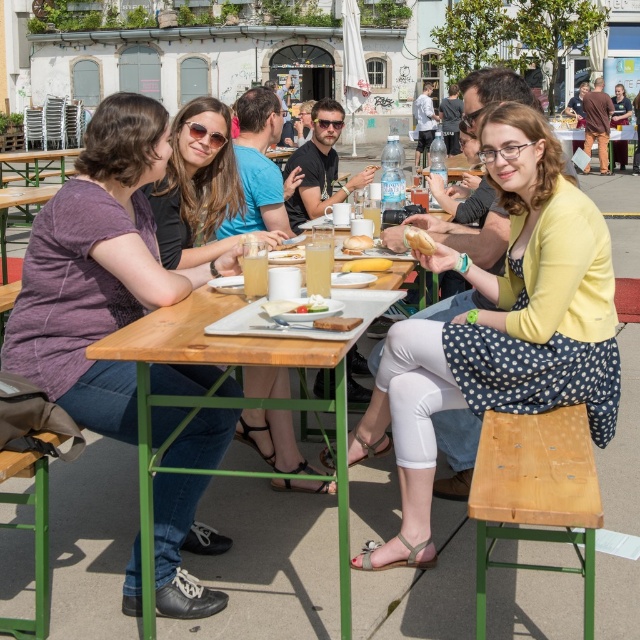
Who is more distant from viewer, (104,344) or (339,317)?

Positioned behind is point (339,317).

Locate an element on the screen. The width and height of the screenshot is (640, 640). wooden table at center is located at coordinates (195, 364).

Does white bread at center appear on the left side of white bread at table center?

No, white bread at center is not to the left of white bread at table center.

Is point (380, 259) farther from viewer compared to point (364, 248)?

No, it is not.

Is point (380, 268) farther from camera compared to point (358, 250)?

No.

Image resolution: width=640 pixels, height=640 pixels. In order to click on white bread at center in this screenshot , I will do `click(365, 264)`.

Does white matte plate at center come behind white glossy plate at center?

That is False.

Is white matte plate at center in front of white glossy plate at center?

Yes, it is.

The height and width of the screenshot is (640, 640). I want to click on white matte plate at center, so click(x=337, y=323).

Identify the location of white matte plate at center. The height and width of the screenshot is (640, 640). (337, 323).